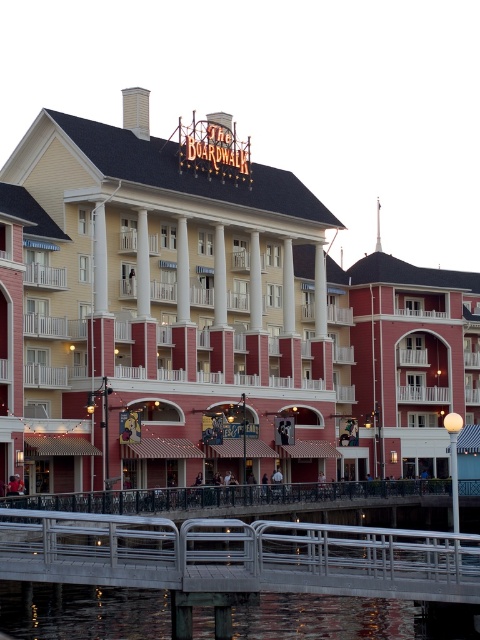
Is silver metallic railing at lower center in front of transparent water at bridge bottom?

Yes, it is.

Is silver metallic railing at lower center smaller than transparent water at bridge bottom?

No, silver metallic railing at lower center is not smaller than transparent water at bridge bottom.

Locate an element on the screen. The width and height of the screenshot is (480, 640). silver metallic railing at lower center is located at coordinates (238, 556).

Which of these two, yellow siding building at center or silver metallic railing at lower center, stands shorter?

Standing shorter between the two is silver metallic railing at lower center.

Does point (260, 164) come closer to viewer compared to point (288, 563)?

No, it is not.

Where is `yellow siding building at center`? The image size is (480, 640). yellow siding building at center is located at coordinates pyautogui.click(x=163, y=308).

Looking at this image, who is more distant from viewer, (205,460) or (308,600)?

The point (205,460) is more distant.

Does point (17, 352) lie in front of point (15, 589)?

No, it is not.

Between point (32, 369) and point (201, 620), which one is positioned in front?

Point (201, 620)

At what (x,y) coordinates should I click in order to perform the action: click on yellow siding building at center. Please return your answer as a coordinate pair (x, y). This screenshot has height=640, width=480. Looking at the image, I should click on (163, 308).